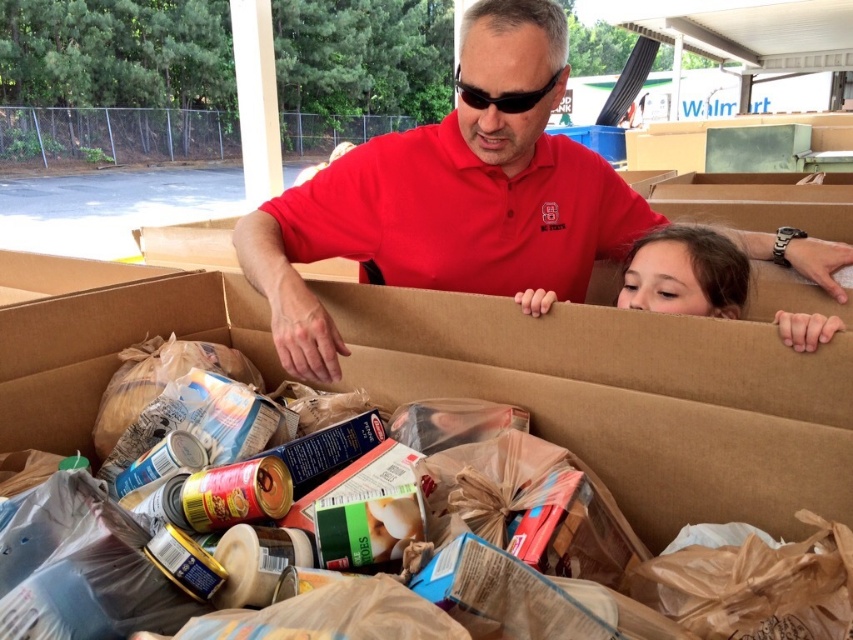
Who is positioned more to the left, brown cardboard box at center or smooth brown hair at upper right?

brown cardboard box at center is more to the left.

Does brown cardboard box at center appear on the right side of smooth brown hair at upper right?

In fact, brown cardboard box at center is to the left of smooth brown hair at upper right.

In order to click on brown cardboard box at center in this screenshot , I will do `click(628, 397)`.

Does smooth brown hair at upper right have a greater height compared to black plastic goggles at upper center?

Yes.

Does smooth brown hair at upper right have a lesser width compared to black plastic goggles at upper center?

In fact, smooth brown hair at upper right might be wider than black plastic goggles at upper center.

Find the location of a particular element. This screenshot has height=640, width=853. smooth brown hair at upper right is located at coordinates (686, 273).

Which of these two, brown cardboard box at center or black plastic goggles at upper center, stands shorter?

black plastic goggles at upper center

Between brown cardboard box at center and black plastic goggles at upper center, which one has more height?

Standing taller between the two is brown cardboard box at center.

Locate an element on the screen. brown cardboard box at center is located at coordinates (628, 397).